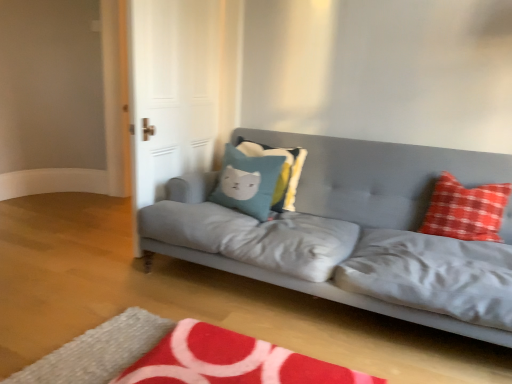
Question: Is red plush rug at lower center situated inside white glossy door at upper left or outside?

Choices:
 (A) outside
 (B) inside

Answer: (A)

Question: In terms of size, does red plush rug at lower center appear bigger or smaller than white glossy door at upper left?

Choices:
 (A) big
 (B) small

Answer: (B)

Question: Considering the real-world distances, which object is farthest from the red checkered pillow at right, which is the first pillow in right-to-left order?

Choices:
 (A) white glossy door at upper left
 (B) red plush rug at lower center
 (C) teal fabric pillow at center, arranged as the second pillow when viewed from the right
 (D) teal fabric pillow with cat design at center, the first pillow positioned from the left
 (E) matte gray couch at center

Answer: (A)

Question: Which object is positioned farthest from the red plush rug at lower center?

Choices:
 (A) teal fabric pillow at center, which is the 2th pillow from left to right
 (B) red checkered pillow at right, acting as the 3th pillow starting from the left
 (C) matte gray couch at center
 (D) white glossy door at upper left
 (E) teal fabric pillow with cat design at center, which appears as the third pillow when viewed from the right

Answer: (D)